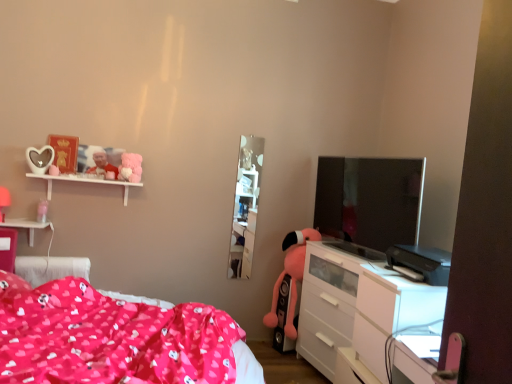
Question: In terms of height, does white glossy tv cabinet at center look taller or shorter compared to fluffy pink plush at upper left, which ranks as the 2th toy in left-to-right order?

Choices:
 (A) short
 (B) tall

Answer: (B)

Question: From a real-world perspective, is white glossy tv cabinet at center physically located above or below fluffy pink plush at upper left, which ranks as the second toy in bottom-to-top order?

Choices:
 (A) above
 (B) below

Answer: (B)

Question: Which object is positioned closest to the white glossy shelf at upper left?

Choices:
 (A) matte pink fabric bed at lower left
 (B) white glossy chest of drawers at lower right
 (C) white matte shelf at upper left
 (D) white glossy tv cabinet at center
 (E) pink plush toy at lower center, which is the third toy in top-to-bottom order

Answer: (C)

Question: Estimate the real-world distances between objects in this image. Which object is closer to the white glossy tv cabinet at center?

Choices:
 (A) silver glossy tv at right
 (B) white matte shelf at upper left
 (C) matte pink fabric bed at lower left
 (D) matte plastic photo frame at upper left, which is counted as the third toy, starting from the bottom
 (E) pink plush toy at lower center, positioned as the 3th toy in left-to-right order

Answer: (E)